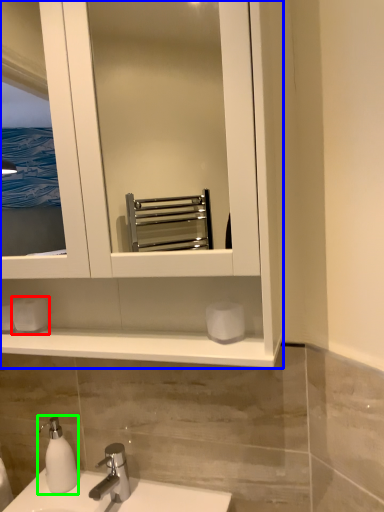
Question: Based on their relative distances, which object is nearer to toilet paper (highlighted by a red box)? Choose from bathroom cabinet (highlighted by a blue box) and soap dispenser (highlighted by a green box).

Choices:
 (A) bathroom cabinet
 (B) soap dispenser

Answer: (B)